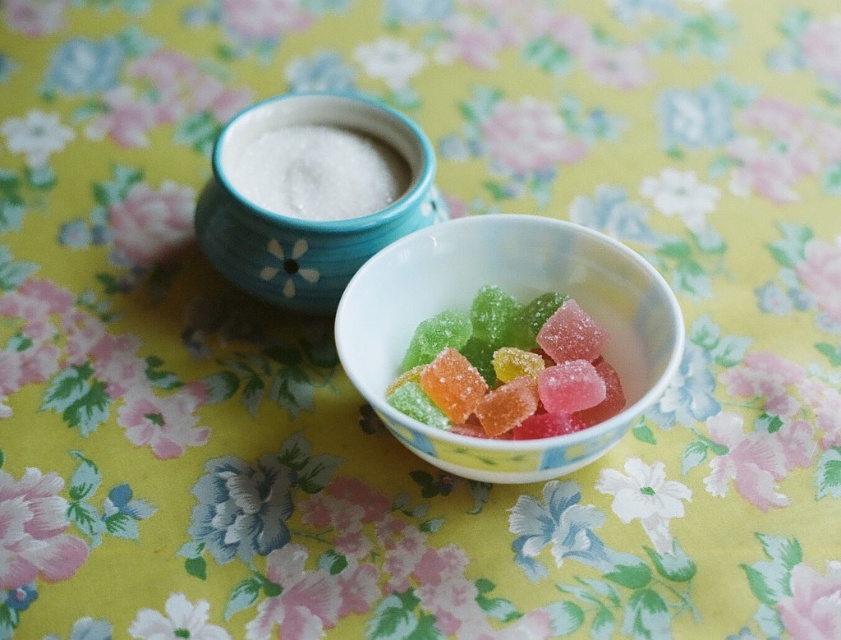
Question: Can you confirm if porcelain bowl at center is positioned below blue ceramic bowl at upper center?

Choices:
 (A) yes
 (B) no

Answer: (A)

Question: Among these objects, which one is farthest from the camera?

Choices:
 (A) blue ceramic bowl at upper center
 (B) white granular sugar at upper center

Answer: (B)

Question: Which of the following is the farthest from the observer?

Choices:
 (A) (237, 272)
 (B) (599, 435)
 (C) (360, 202)

Answer: (C)

Question: Which point appears farthest from the camera in this image?

Choices:
 (A) (475, 330)
 (B) (563, 445)

Answer: (A)

Question: Observing the image, what is the correct spatial positioning of porcelain bowl at center in reference to blue ceramic bowl at upper center?

Choices:
 (A) above
 (B) below

Answer: (B)

Question: Does blue ceramic bowl at upper center appear over white granular sugar at upper center?

Choices:
 (A) no
 (B) yes

Answer: (A)